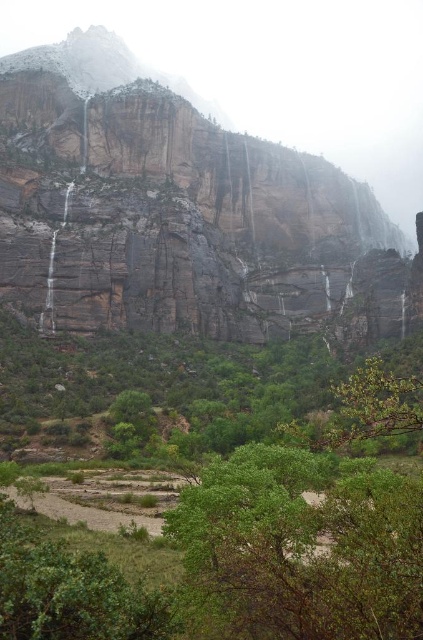
Question: Does rustic stone mountain at upper center have a greater width compared to green leafy tree at lower left?

Choices:
 (A) yes
 (B) no

Answer: (A)

Question: Which point is closer to the camera taking this photo?

Choices:
 (A) (209, 561)
 (B) (184, 384)
 (C) (187, 292)

Answer: (A)

Question: Which object is the closest to the green leafy tree at lower center?

Choices:
 (A) rustic stone mountain at upper center
 (B) green leafy tree at lower left

Answer: (B)

Question: Is the position of rustic stone mountain at upper center more distant than that of green leafy tree at lower left?

Choices:
 (A) no
 (B) yes

Answer: (B)

Question: Does rustic stone mountain at upper center appear on the right side of green leafy tree at lower center?

Choices:
 (A) no
 (B) yes

Answer: (A)

Question: Which object appears farthest from the camera in this image?

Choices:
 (A) rustic stone mountain at upper center
 (B) green leafy tree at lower left
 (C) green leafy tree at lower center

Answer: (A)